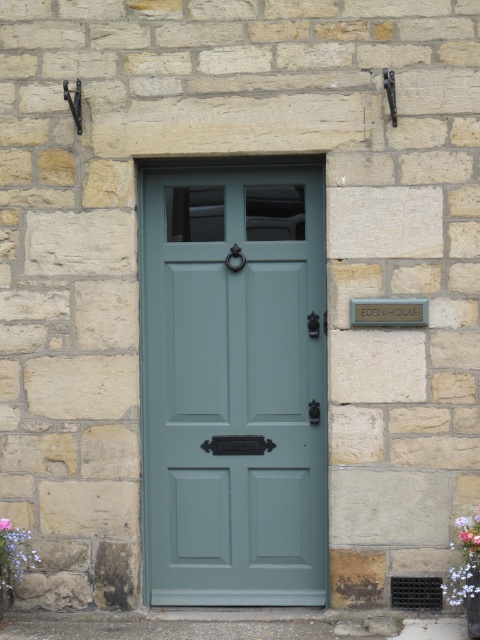
Question: Estimate the real-world distances between objects in this image. Which object is closer to the purple matte flower at lower left?

Choices:
 (A) satin green door at center
 (B) purple floral bouquet at lower right

Answer: (A)

Question: Which of these objects is positioned closest to the purple floral bouquet at lower right?

Choices:
 (A) satin green door at center
 (B) purple matte flower at lower left

Answer: (A)

Question: Does purple floral bouquet at lower right appear on the left side of purple matte flower at lower left?

Choices:
 (A) no
 (B) yes

Answer: (A)

Question: Which of these objects is positioned closest to the purple floral bouquet at lower right?

Choices:
 (A) purple matte flower at lower left
 (B) satin green door at center

Answer: (B)

Question: Can you confirm if satin green door at center is smaller than purple floral bouquet at lower right?

Choices:
 (A) no
 (B) yes

Answer: (A)

Question: Considering the relative positions of satin green door at center and purple floral bouquet at lower right in the image provided, where is satin green door at center located with respect to purple floral bouquet at lower right?

Choices:
 (A) right
 (B) left

Answer: (B)